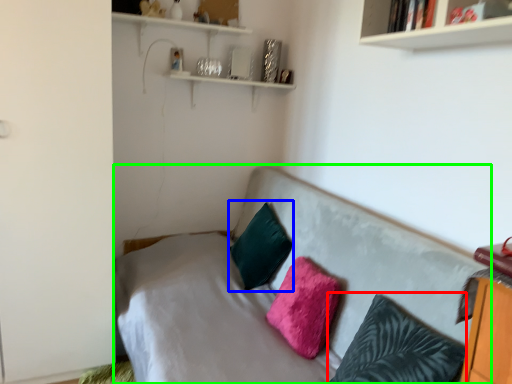
Question: Based on their relative distances, which object is nearer to pillow (highlighted by a red box)? Choose from pillow (highlighted by a blue box) and studio couch (highlighted by a green box).

Choices:
 (A) pillow
 (B) studio couch

Answer: (B)